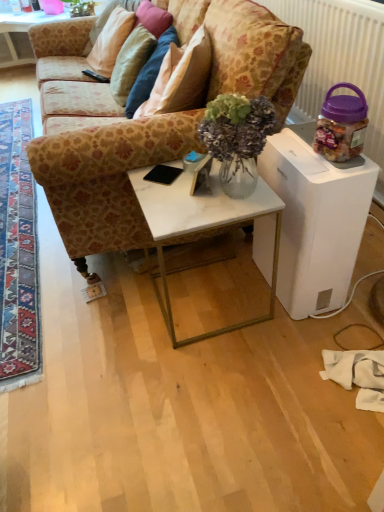
Locate an element on the screen. Image resolution: width=384 pixels, height=512 pixels. free space between white marble table at center, arranged as the second table when viewed from the front, and white glossy humidifier at right, which is the second table from bottom to top is located at coordinates (248, 314).